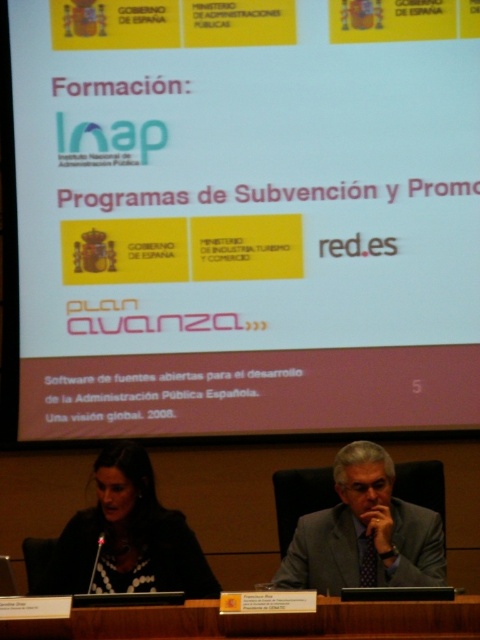
You are standing in the conference room and want to reach the point marked at coordinates (x=324, y=35). The room has a door 10 feet away from your current position. Can you walk directly to the point without passing through the door?

The point marked at coordinates (x=324, y=35) is 15.28 feet away from the viewer. Since the door is only 10 feet away, you would need to go through the door to reach the point as it is further away than the door.

You are organizing a presentation and need to ensure that the white matte projection screen at upper center and the brown wood table at lower center are positioned correctly. Based on the scene, which object is taller?

The white matte projection screen at upper center is taller than the brown wood table at lower center.